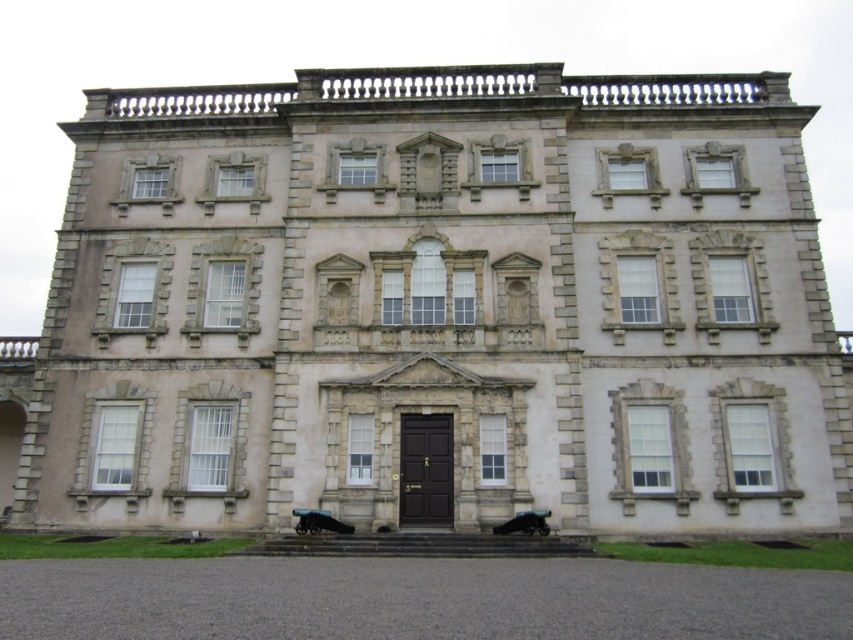
In the scene shown: Does shiny black dog at center have a lesser height compared to shiny black car at lower center?

In fact, shiny black dog at center may be taller than shiny black car at lower center.

Does shiny black dog at center lie in front of shiny black car at lower center?

No, shiny black dog at center is further to the viewer.

Find the location of a particular element. The width and height of the screenshot is (853, 640). shiny black dog at center is located at coordinates (318, 522).